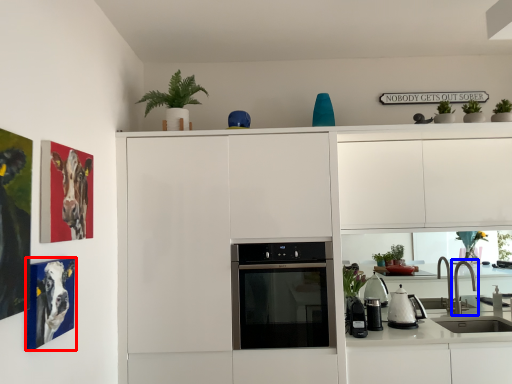
Question: Among these objects, which one is farthest to the camera, picture frame (highlighted by a red box) or tap (highlighted by a blue box)?

Choices:
 (A) picture frame
 (B) tap

Answer: (B)